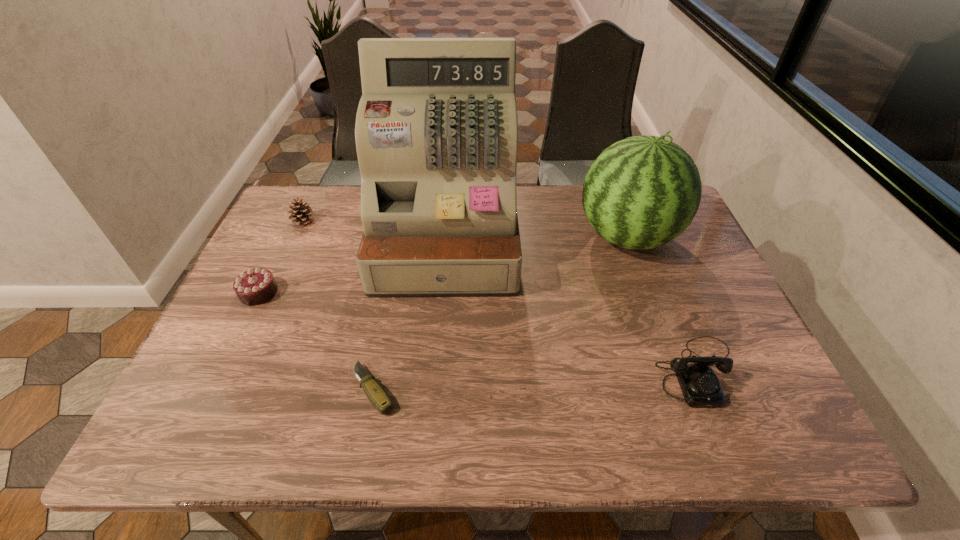
I want to click on object present at the far left corner, so click(x=302, y=213).

Identify the location of object situated at the far right corner. This screenshot has height=540, width=960. (642, 192).

You are a GUI agent. You are given a task and a screenshot of the screen. Output one action in this format:
    pyautogui.click(x=<x>, y=<y>)
    Task: Click on the object present at the near right corner
    Image resolution: width=960 pixels, height=540 pixels.
    Given the screenshot: What is the action you would take?
    pyautogui.click(x=700, y=386)

The height and width of the screenshot is (540, 960). In the image, there is a desktop. Identify the location of vacant area at the left edge. (238, 386).

The width and height of the screenshot is (960, 540). Identify the location of vacant space at the right edge of the desktop. (678, 304).

Where is `vacant space at the near left corner`? The width and height of the screenshot is (960, 540). vacant space at the near left corner is located at coordinates [x=214, y=413].

I want to click on free space between the pinecone and the pocketknife, so click(x=338, y=305).

I want to click on free space between the pocketknife and the tallest object, so click(410, 314).

Find the location of `vacant area between the fifth shortest object and the cash register`. vacant area between the fifth shortest object and the cash register is located at coordinates (537, 238).

The image size is (960, 540). I want to click on vacant area that lies between the shortest object and the pinecone, so click(338, 305).